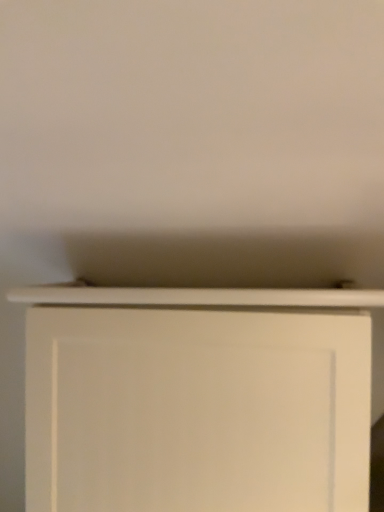
Locate an element on the screen. white matte cabinet at center is located at coordinates (182, 385).

Describe the element at coordinates (182, 385) in the screenshot. I see `white matte cabinet at center` at that location.

The height and width of the screenshot is (512, 384). In order to click on white matte cabinet at center in this screenshot , I will do `click(182, 385)`.